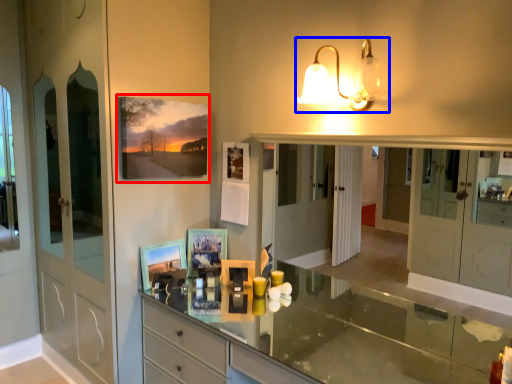
Question: Which object is further to the camera taking this photo, picture frame (highlighted by a red box) or lamp (highlighted by a blue box)?

Choices:
 (A) picture frame
 (B) lamp

Answer: (A)